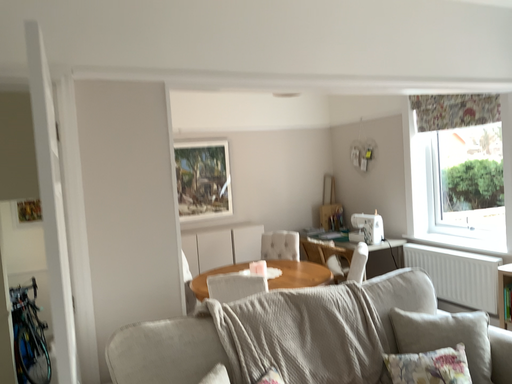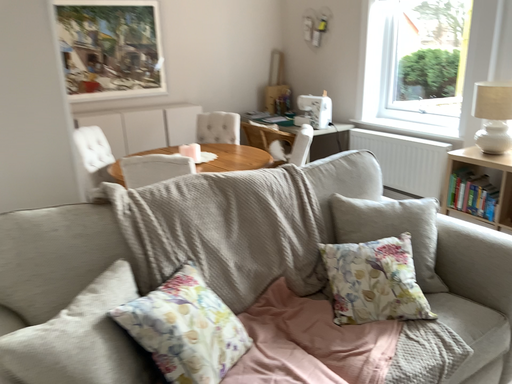
Question: How did the camera likely rotate when shooting the video?

Choices:
 (A) rotated right
 (B) rotated left

Answer: (A)